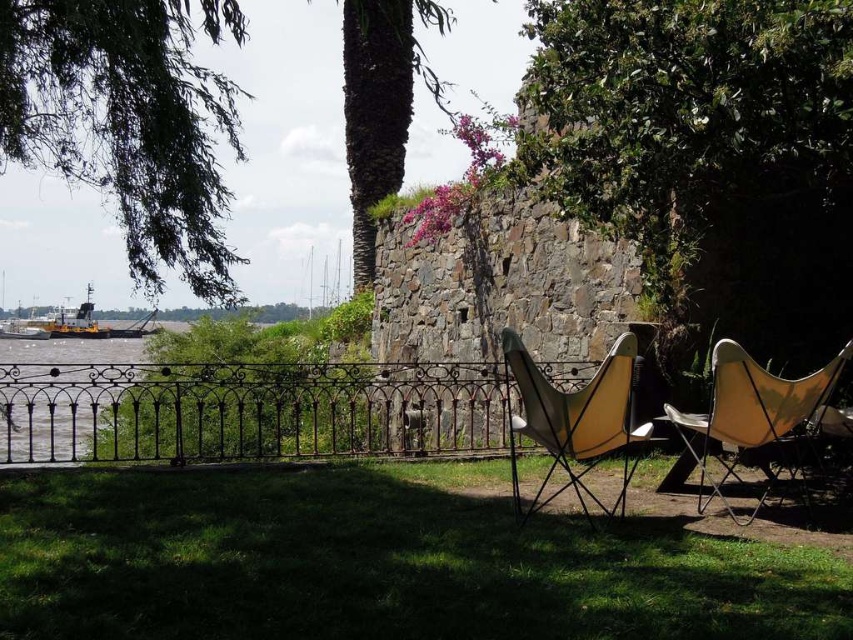
Question: Which object is farther from the camera taking this photo?

Choices:
 (A) yellow fabric chair at right
 (B) matte yellow chair at center

Answer: (B)

Question: Is green grass at lower center wider than yellow fabric chair at right?

Choices:
 (A) no
 (B) yes

Answer: (B)

Question: Does rusty metal fence at left appear over yellow matte boat at lower left?

Choices:
 (A) yes
 (B) no

Answer: (B)

Question: Among these objects, which one is farthest from the camera?

Choices:
 (A) matte yellow chair at center
 (B) rusty metal fence at left
 (C) green leafy tree at upper left

Answer: (C)

Question: Which point is farther from the camera taking this photo?

Choices:
 (A) (350, 144)
 (B) (830, 380)

Answer: (A)

Question: Can you confirm if rusty metal fence at left is thinner than yellow fabric chair at right?

Choices:
 (A) no
 (B) yes

Answer: (A)